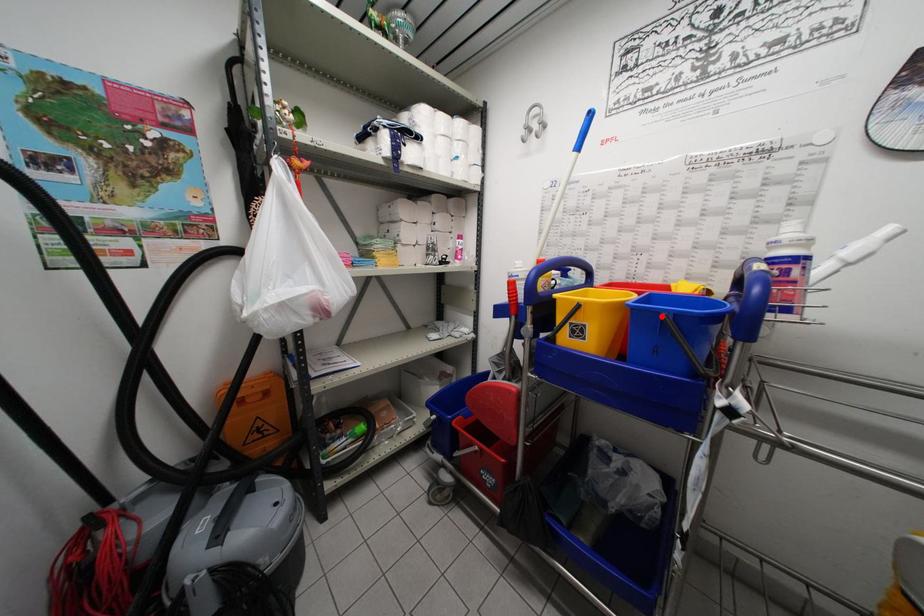
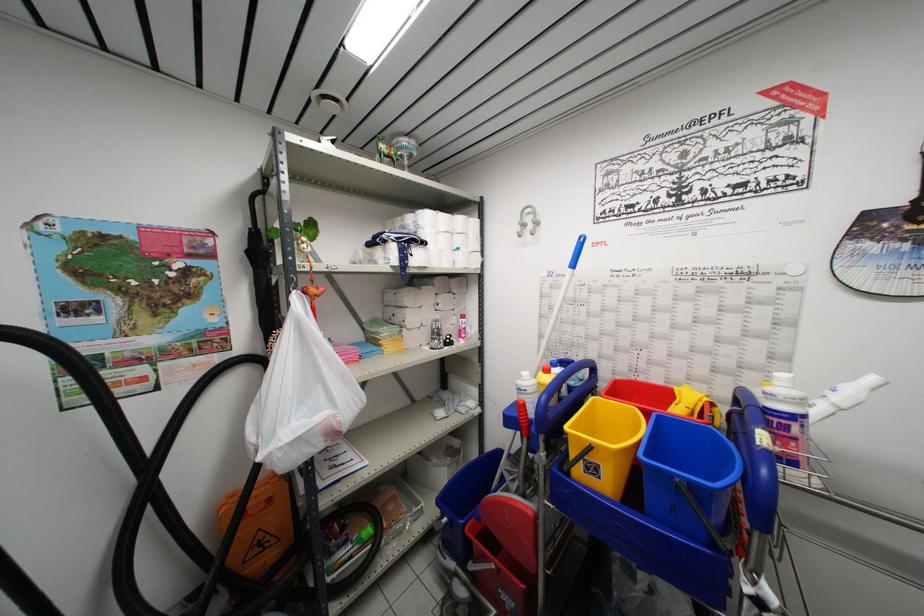
The point at the highlighted location is marked in the first image. Where is the corresponding point in the second image?

(675, 479)